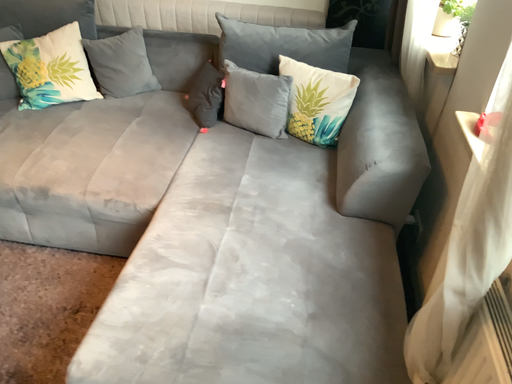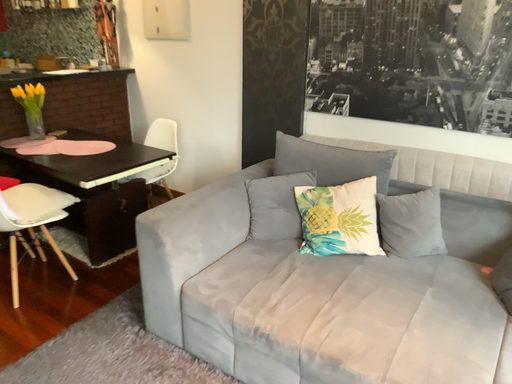
Question: How did the camera likely rotate when shooting the video?

Choices:
 (A) rotated left
 (B) rotated right

Answer: (A)